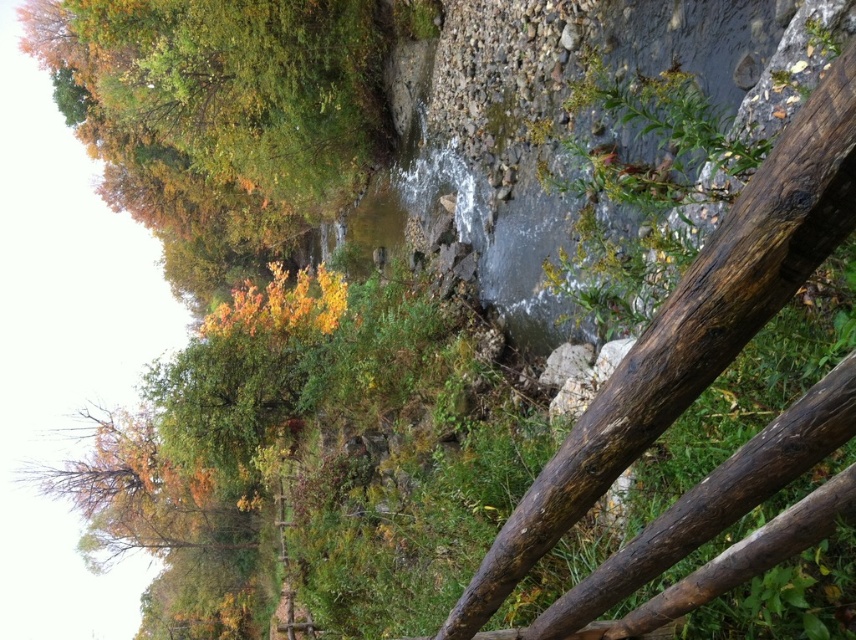
Question: Which of the following is the closest to the observer?

Choices:
 (A) brown rough wood at center right
 (B) autumn leaves at upper left

Answer: (A)

Question: Among these objects, which one is farthest from the camera?

Choices:
 (A) brown rough wood at center right
 (B) autumn leaves at upper left

Answer: (B)

Question: Can you confirm if autumn leaves at upper left is positioned below brown rough wood at center right?

Choices:
 (A) yes
 (B) no

Answer: (B)

Question: From the image, what is the correct spatial relationship of autumn leaves at upper left in relation to brown rough wood at center right?

Choices:
 (A) left
 (B) right

Answer: (A)

Question: Which point appears closest to the camera in this image?

Choices:
 (A) (170, 163)
 (B) (738, 262)

Answer: (B)

Question: Is autumn leaves at upper left closer to the viewer compared to brown rough wood at center right?

Choices:
 (A) yes
 (B) no

Answer: (B)